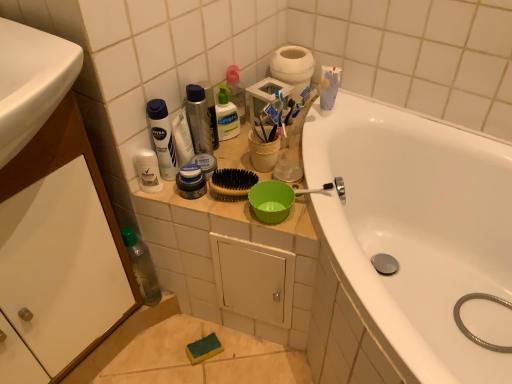
This screenshot has height=384, width=512. Find the location of `free space in front of translucent plastic bottle at upper center, acting as the first cleaning product starting from the right`. free space in front of translucent plastic bottle at upper center, acting as the first cleaning product starting from the right is located at coordinates (243, 152).